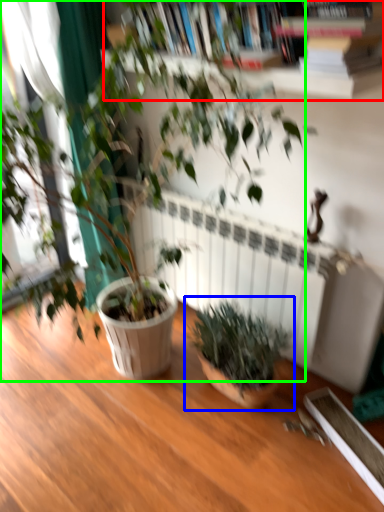
Question: Which is nearer to the bookcase (highlighted by a red box)? houseplant (highlighted by a blue box) or houseplant (highlighted by a green box).

Choices:
 (A) houseplant
 (B) houseplant

Answer: (B)